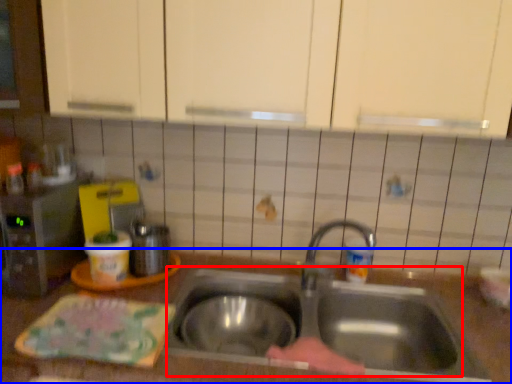
Question: Among these objects, which one is farthest to the camera, sink (highlighted by a red box) or countertop (highlighted by a blue box)?

Choices:
 (A) sink
 (B) countertop

Answer: (A)